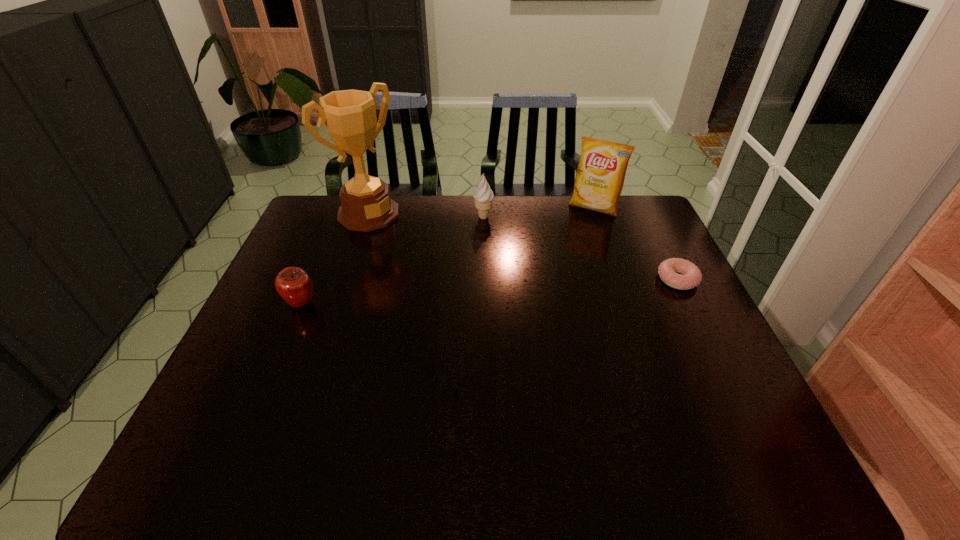
Where is `award that is at the far edge`? This screenshot has height=540, width=960. award that is at the far edge is located at coordinates click(350, 115).

Locate an element on the screen. This screenshot has width=960, height=540. crisp (potato chip) positioned at the far edge is located at coordinates 600,175.

This screenshot has width=960, height=540. Identify the location of apple that is at the left edge. (295, 286).

This screenshot has width=960, height=540. Find the location of `award at the left edge`. award at the left edge is located at coordinates (350, 115).

Where is `doughnut that is at the right edge`? The width and height of the screenshot is (960, 540). doughnut that is at the right edge is located at coordinates (668, 270).

The height and width of the screenshot is (540, 960). Identify the location of crisp (potato chip) that is at the right edge. (600, 175).

This screenshot has height=540, width=960. Find the location of `object situated at the far left corner`. object situated at the far left corner is located at coordinates (350, 115).

The image size is (960, 540). Identify the location of object situated at the far right corner. (600, 175).

Find the location of `free region at the far edge of the desktop`. free region at the far edge of the desktop is located at coordinates (557, 213).

At what (x,y) coordinates should I click in order to perform the action: click on vacant area at the near edge of the desktop. Please return your answer as a coordinate pair (x, y). The width and height of the screenshot is (960, 540). Looking at the image, I should click on (451, 396).